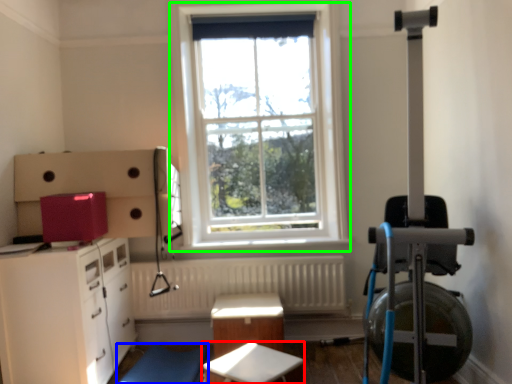
Question: Estimate the real-world distances between objects in this image. Which object is farther from table (highlighted by a red box), swivel chair (highlighted by a blue box) or window (highlighted by a green box)?

Choices:
 (A) swivel chair
 (B) window

Answer: (B)